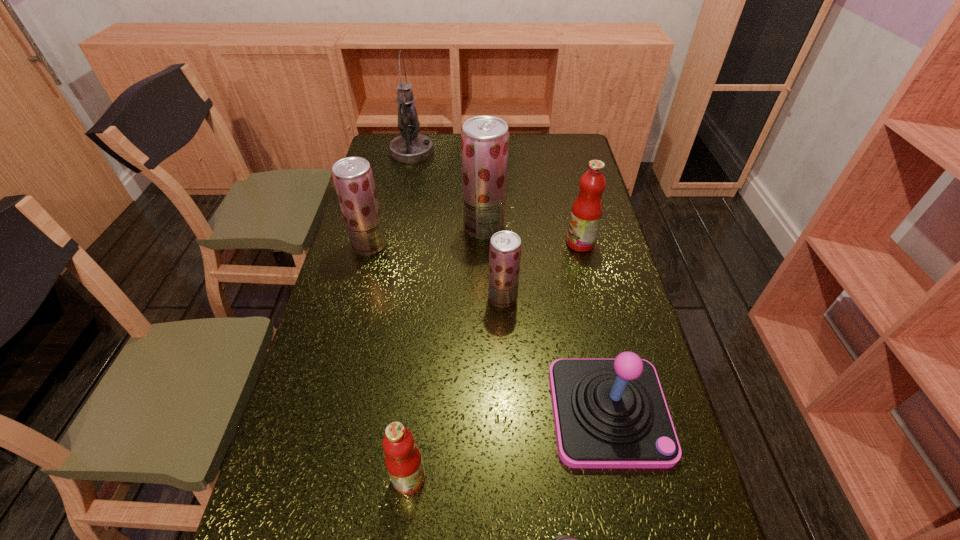
You are a GUI agent. You are given a task and a screenshot of the screen. Output one action in this format:
    pyautogui.click(x=<x>, y=<y>)
    Task: Click on the object identified as the third closest to the right pink fruit juice
    The width and height of the screenshot is (960, 540).
    Given the screenshot: What is the action you would take?
    pyautogui.click(x=609, y=413)

Locate which fruit juice is the fourth closest to the farthest object. Please provide its 2D coordinates. Your answer should be formatted as a tuple, i.e. [(x, y)], where the tuple contains the x and y coordinates of a point satisfying the conditions above.

[(505, 247)]

Where is `fruit juice that stands as the third closest to the bigger pink fruit juice`? The image size is (960, 540). fruit juice that stands as the third closest to the bigger pink fruit juice is located at coordinates (353, 178).

Identify which strawberry fruit juice is the third nearest to the shortest object. Please provide its 2D coordinates. Your answer should be formatted as a tuple, i.e. [(x, y)], where the tuple contains the x and y coordinates of a point satisfying the conditions above.

[(353, 178)]

Locate which strawberry fruit juice is the second closest to the nearest fruit juice. Please provide its 2D coordinates. Your answer should be formatted as a tuple, i.e. [(x, y)], where the tuple contains the x and y coordinates of a point satisfying the conditions above.

[(353, 178)]

Locate an element on the screen. free space in the image that satisfies the following two spatial constraints: 1. on the back side of the leftmost fruit juice; 2. on the left side of the biggest strawberry fruit juice is located at coordinates pos(373,227).

Locate an element on the screen. The height and width of the screenshot is (540, 960). vacant area in the image that satisfies the following two spatial constraints: 1. on the front label of the bigger pink fruit juice; 2. forward from the base of the pink joystick is located at coordinates (620, 411).